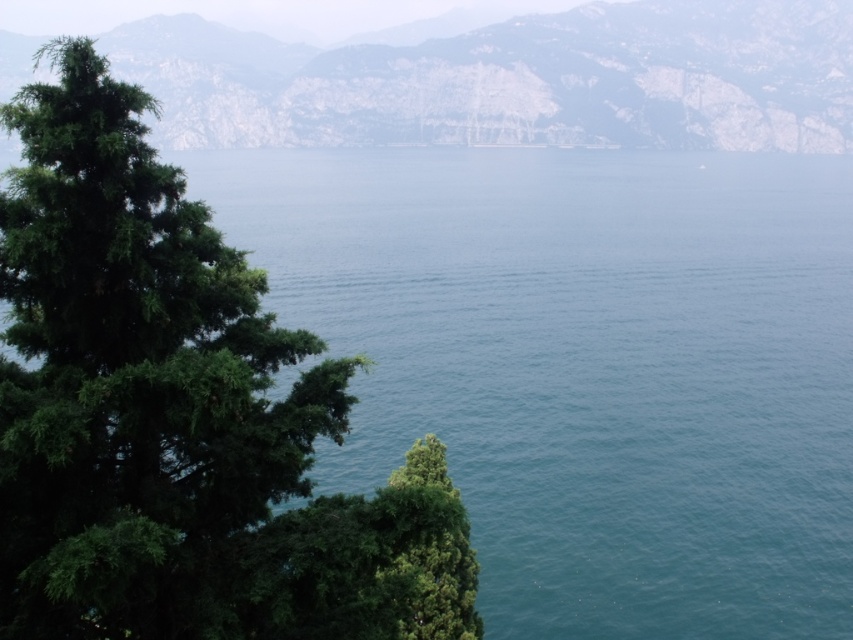
You are standing on the lakeside and see the green leafy tree at left and the green textured mountain at upper center. Which object is positioned more towards the right side of your view?

The green leafy tree at left is positioned to the right of the green textured mountain at upper center, so it is more towards the right side of your view.

You are standing at the point marked as point (178, 416) in the image. Based on the scene description, what object are you currently standing on?

You are standing on the green leafy tree at left, as the point (178, 416) is located on it.